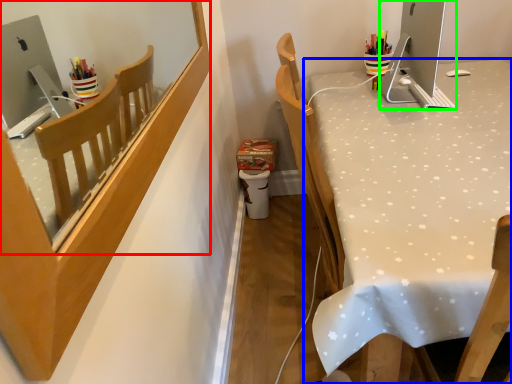
Question: Which object is the closest to the mirror (highlighted by a red box)? Choose among these: desk (highlighted by a blue box) or desktop (highlighted by a green box).

Choices:
 (A) desk
 (B) desktop

Answer: (A)